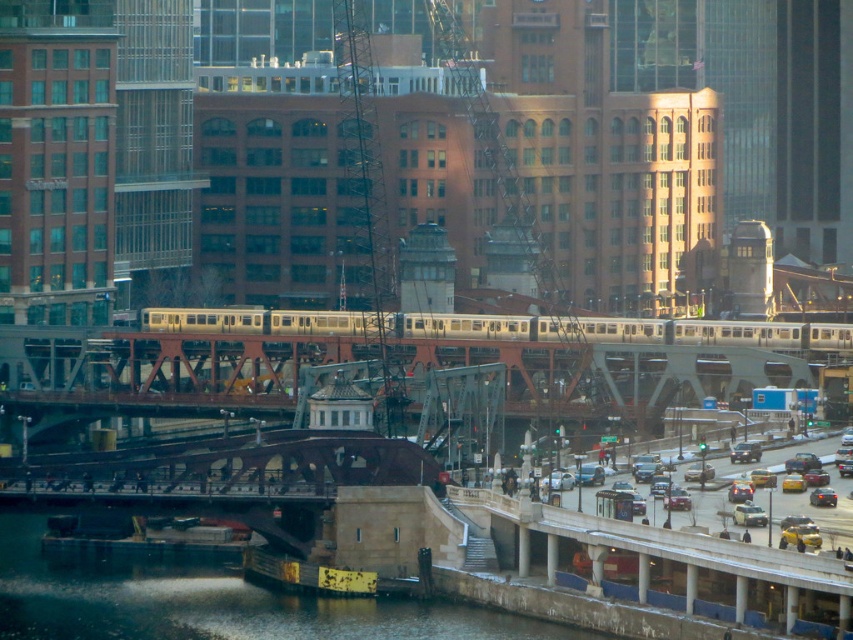
Does point (572, 381) come behind point (225, 568)?

Yes, point (572, 381) is behind point (225, 568).

Between steel bridge at center and dark gray concrete river at lower left, which one is positioned lower?

dark gray concrete river at lower left is below.

The width and height of the screenshot is (853, 640). What do you see at coordinates (183, 371) in the screenshot?
I see `steel bridge at center` at bounding box center [183, 371].

Where is `steel bridge at center`? steel bridge at center is located at coordinates (183, 371).

Between dark gray concrete river at lower left and silver metallic train at center, which one has more height?

Standing taller between the two is dark gray concrete river at lower left.

Which is below, dark gray concrete river at lower left or silver metallic train at center?

dark gray concrete river at lower left is below.

Between point (80, 632) and point (225, 321), which one is positioned in front?

Point (80, 632) is in front.

Where is `dark gray concrete river at lower left`? The height and width of the screenshot is (640, 853). dark gray concrete river at lower left is located at coordinates (207, 602).

Which is more to the right, silver metallic train at center or yellow metallic taxi at lower right?

From the viewer's perspective, yellow metallic taxi at lower right appears more on the right side.

Does silver metallic train at center appear under yellow metallic taxi at lower right?

No, silver metallic train at center is not below yellow metallic taxi at lower right.

The width and height of the screenshot is (853, 640). I want to click on silver metallic train at center, so click(718, 332).